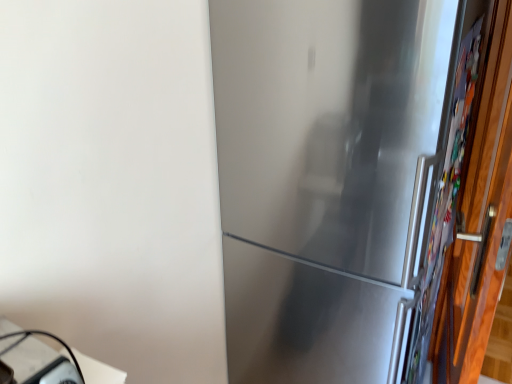
Question: Considering the relative sizes of wooden door at right and white glossy table at lower left in the image provided, is wooden door at right shorter than white glossy table at lower left?

Choices:
 (A) no
 (B) yes

Answer: (A)

Question: Does wooden door at right touch white glossy table at lower left?

Choices:
 (A) yes
 (B) no

Answer: (B)

Question: Are wooden door at right and white glossy table at lower left located far from each other?

Choices:
 (A) no
 (B) yes

Answer: (B)

Question: Is wooden door at right located outside white glossy table at lower left?

Choices:
 (A) no
 (B) yes

Answer: (B)

Question: Does wooden door at right lie in front of white glossy table at lower left?

Choices:
 (A) no
 (B) yes

Answer: (B)

Question: Is white glossy table at lower left located within wooden door at right?

Choices:
 (A) yes
 (B) no

Answer: (B)

Question: Is wooden door at right located within white glossy table at lower left?

Choices:
 (A) no
 (B) yes

Answer: (A)

Question: From the image's perspective, would you say white glossy table at lower left is shown under wooden door at right?

Choices:
 (A) no
 (B) yes

Answer: (B)

Question: Considering the relative positions of white glossy table at lower left and wooden door at right in the image provided, is white glossy table at lower left to the left of wooden door at right from the viewer's perspective?

Choices:
 (A) no
 (B) yes

Answer: (B)

Question: Is white glossy table at lower left bigger than wooden door at right?

Choices:
 (A) yes
 (B) no

Answer: (B)

Question: Does white glossy table at lower left have a lesser width compared to wooden door at right?

Choices:
 (A) no
 (B) yes

Answer: (A)

Question: Is white glossy table at lower left behind wooden door at right?

Choices:
 (A) yes
 (B) no

Answer: (A)

Question: Can you confirm if white glossy table at lower left is smaller than satin silver refrigerator at center?

Choices:
 (A) no
 (B) yes

Answer: (B)